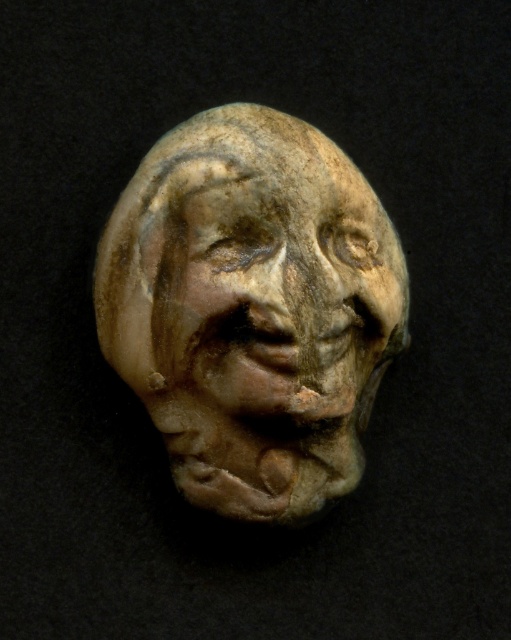
Question: Where is matte clay bust at center located in relation to earthenware mask at center in the image?

Choices:
 (A) right
 (B) left

Answer: (B)

Question: Which point is farther to the camera?

Choices:
 (A) (145, 225)
 (B) (197, 358)

Answer: (B)

Question: Is matte clay bust at center wider than earthenware mask at center?

Choices:
 (A) no
 (B) yes

Answer: (B)

Question: Which of the following is the closest to the observer?

Choices:
 (A) (297, 269)
 (B) (266, 308)

Answer: (B)

Question: Does matte clay bust at center appear over earthenware mask at center?

Choices:
 (A) no
 (B) yes

Answer: (A)